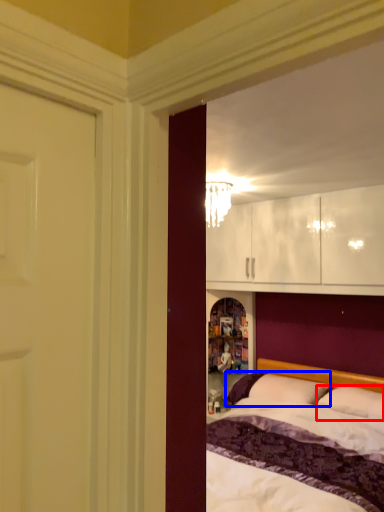
Question: Which point is further to the camera, pillow (highlighted by a red box) or pillow (highlighted by a blue box)?

Choices:
 (A) pillow
 (B) pillow

Answer: (B)